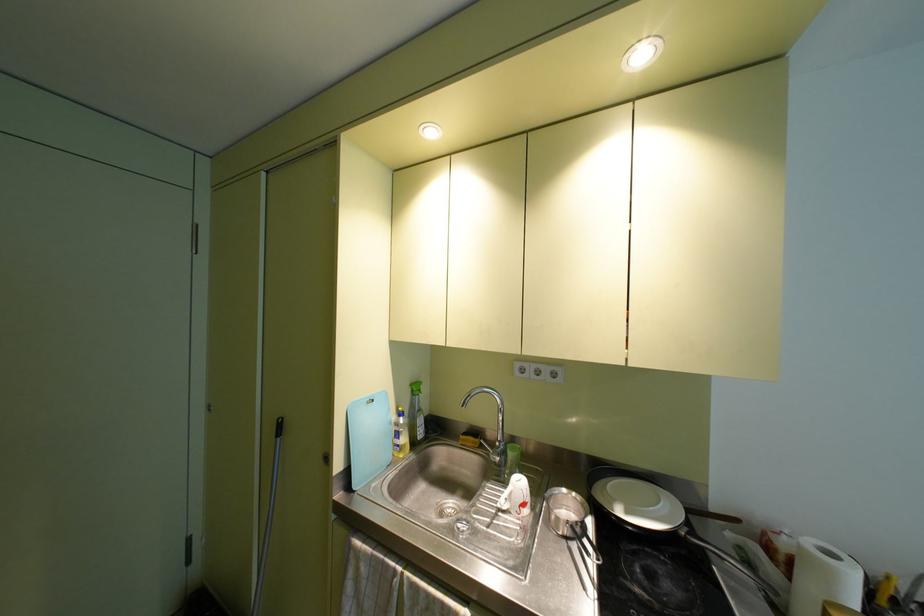
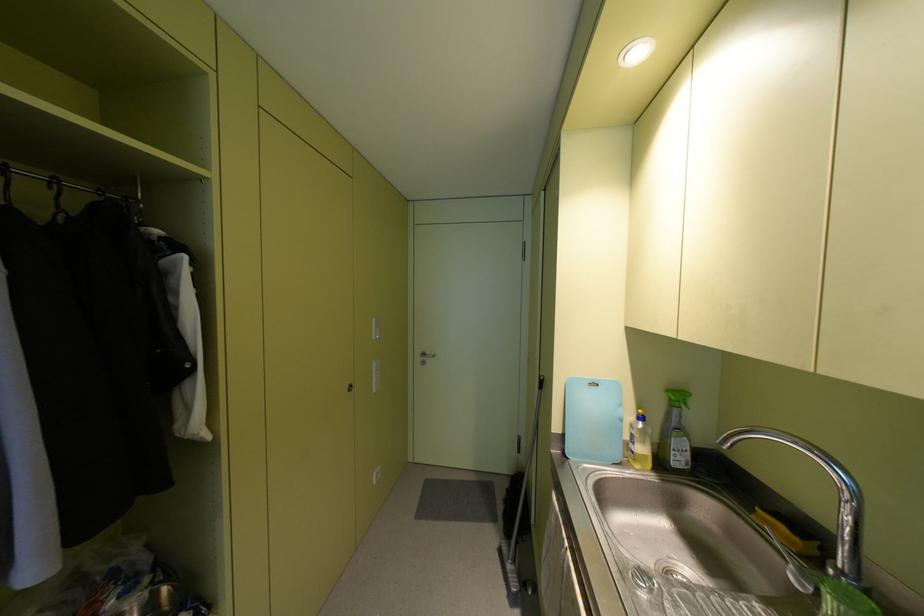
Question: Based on the continuous images, in which direction is the camera rotating? Reply with the corresponding letter.

Choices:
 (A) Left
 (B) Right
 (C) Up
 (D) Down

Answer: (A)